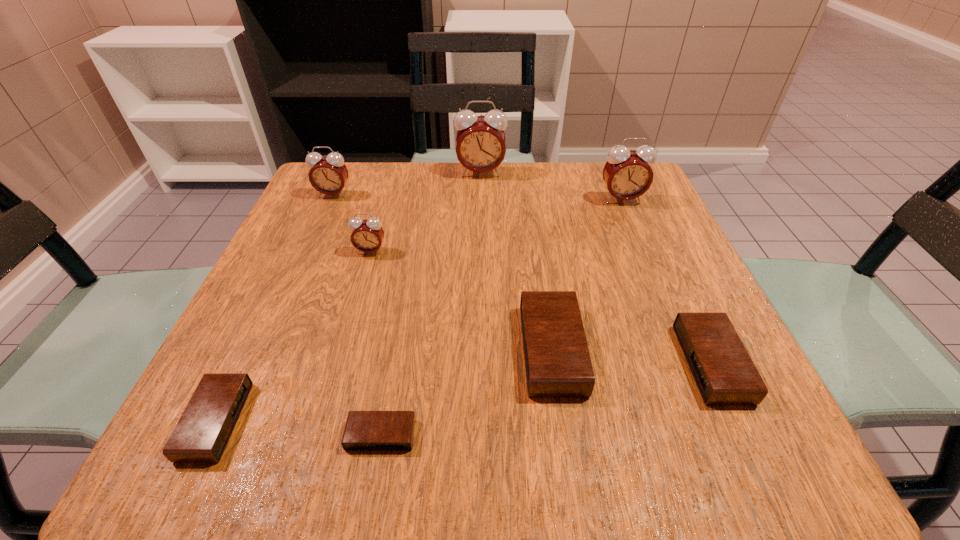
Where is `the fourth object from right to left`? The width and height of the screenshot is (960, 540). the fourth object from right to left is located at coordinates (480, 147).

Identify the location of the second pink alarm clock from right to left. (480, 147).

You are a GUI agent. You are given a task and a screenshot of the screen. Output one action in this format:
    pyautogui.click(x=<x>, y=<y>)
    Task: Click on the rightmost pink alarm clock
    Image resolution: width=960 pixels, height=540 pixels.
    Given the screenshot: What is the action you would take?
    pyautogui.click(x=627, y=174)

In order to click on the seventh shortest alarm clock in this screenshot , I will do `click(627, 174)`.

Where is `the second smallest pink alarm clock`? the second smallest pink alarm clock is located at coordinates (329, 174).

This screenshot has width=960, height=540. What are the coordinates of `the leftmost pink alarm clock` in the screenshot? It's located at (329, 174).

Find the location of a particular element. The image size is (960, 540). the fifth shortest alarm clock is located at coordinates pos(367,235).

Identify the location of the fourth farthest object. (367, 235).

At what (x,y) coordinates should I click in order to perform the action: click on the third alarm clock from right to left. Please return your answer as a coordinate pair (x, y). Looking at the image, I should click on (557, 361).

Image resolution: width=960 pixels, height=540 pixels. Identify the location of the fifth tallest alarm clock. (557, 361).